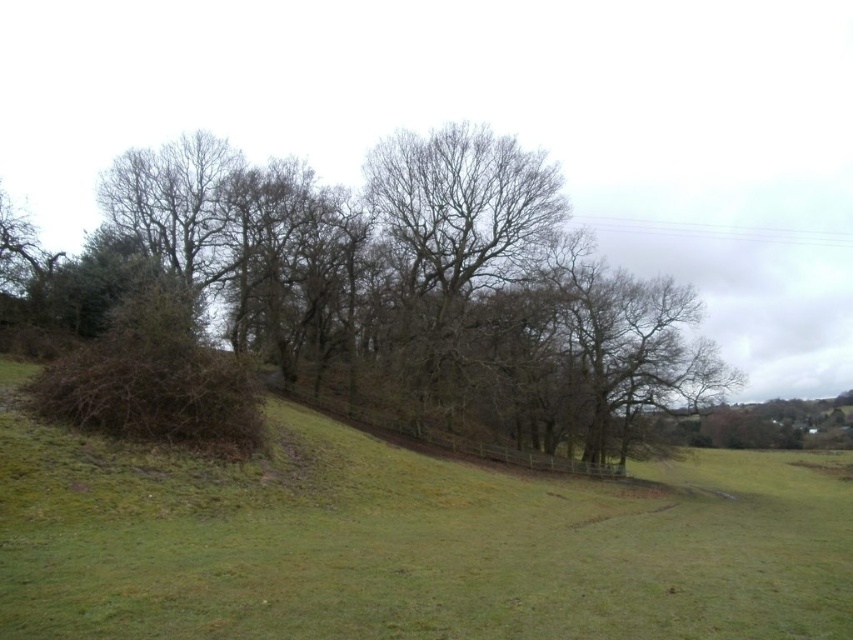
You are a hiker standing at the edge of the field looking towards the center. You see the bare branches at center and the green grassy hill at center. Which object is positioned higher in the scene?

The bare branches at center are positioned higher than the green grassy hill at center because the description states that the bare branches at center is above the green grassy hill at center.

You are a hiker carrying a 15 meter long rope. You want to tie the rope between the bare branches at center and the green grassy hill at center. Will the rope be long enough to stretch between them?

The distance between the bare branches at center and the green grassy hill at center is 14.99 meters. Since the rope is 15 meters long, it will be just long enough to stretch between them.

You are standing in the middle of the field and see two points marked in the image. Which point is closer to you, point (x=538, y=385) or point (x=585, y=602)?

Point (x=538, y=385) is closer to you because it is further to the viewer than point (x=585, y=602).